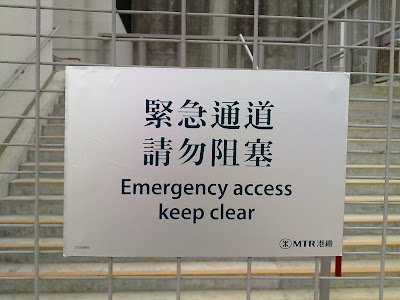
This screenshot has height=300, width=400. In order to click on handrail on the left of stairs in this screenshot , I will do `click(46, 43)`.